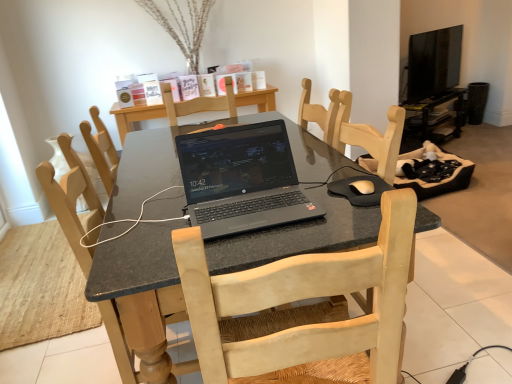
Question: From their relative heights in the image, would you say black granite desk at center is taller or shorter than black rubber mousepad at center?

Choices:
 (A) short
 (B) tall

Answer: (B)

Question: From a real-world perspective, relative to black rubber mousepad at center, is black granite desk at center vertically above or below?

Choices:
 (A) above
 (B) below

Answer: (B)

Question: Which of these objects is positioned farthest from the black glossy tv at upper right?

Choices:
 (A) black rubber mousepad at center
 (B) light wood chair at center
 (C) black glossy computer desk at upper right
 (D) black granite desk at center
 (E) black matte laptop at center

Answer: (B)

Question: Estimate the real-world distances between objects in this image. Which object is farther from the black glossy tv at upper right?

Choices:
 (A) black rubber mousepad at center
 (B) light wood chair at center
 (C) black matte laptop at center
 (D) black granite desk at center
 (E) black glossy computer desk at upper right

Answer: (B)